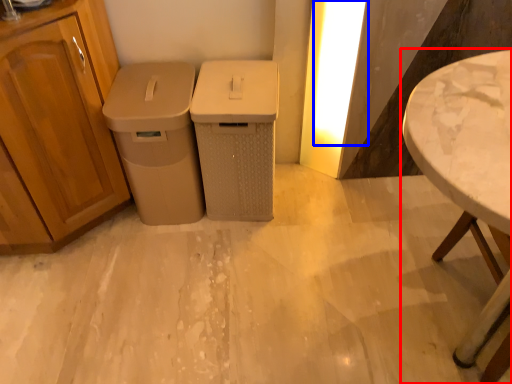
Question: Which object is further to the camera taking this photo, table (highlighted by a red box) or light (highlighted by a blue box)?

Choices:
 (A) table
 (B) light

Answer: (B)